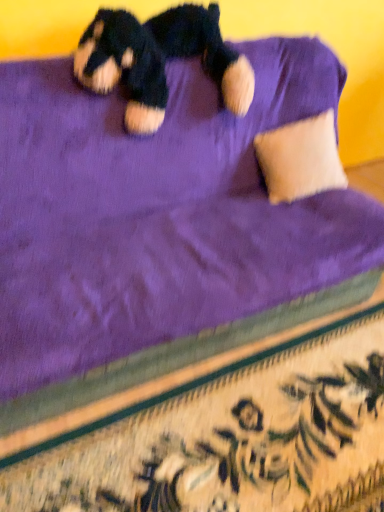
Question: From the image's perspective, is soft plush teddy bear at upper center located above or below beige soft pillow at upper right?

Choices:
 (A) below
 (B) above

Answer: (B)

Question: Considering the relative positions of soft plush teddy bear at upper center and beige soft pillow at upper right in the image provided, is soft plush teddy bear at upper center to the left or to the right of beige soft pillow at upper right?

Choices:
 (A) right
 (B) left

Answer: (B)

Question: Which is correct: soft plush teddy bear at upper center is inside beige soft pillow at upper right, or outside of it?

Choices:
 (A) outside
 (B) inside

Answer: (A)

Question: From the image's perspective, is beige soft pillow at upper right located above or below soft plush teddy bear at upper center?

Choices:
 (A) below
 (B) above

Answer: (A)

Question: Is beige soft pillow at upper right spatially inside soft plush teddy bear at upper center, or outside of it?

Choices:
 (A) inside
 (B) outside

Answer: (B)

Question: Visually, is beige soft pillow at upper right positioned to the left or to the right of soft plush teddy bear at upper center?

Choices:
 (A) left
 (B) right

Answer: (B)

Question: In the image, is beige soft pillow at upper right positioned in front of or behind soft plush teddy bear at upper center?

Choices:
 (A) front
 (B) behind

Answer: (B)